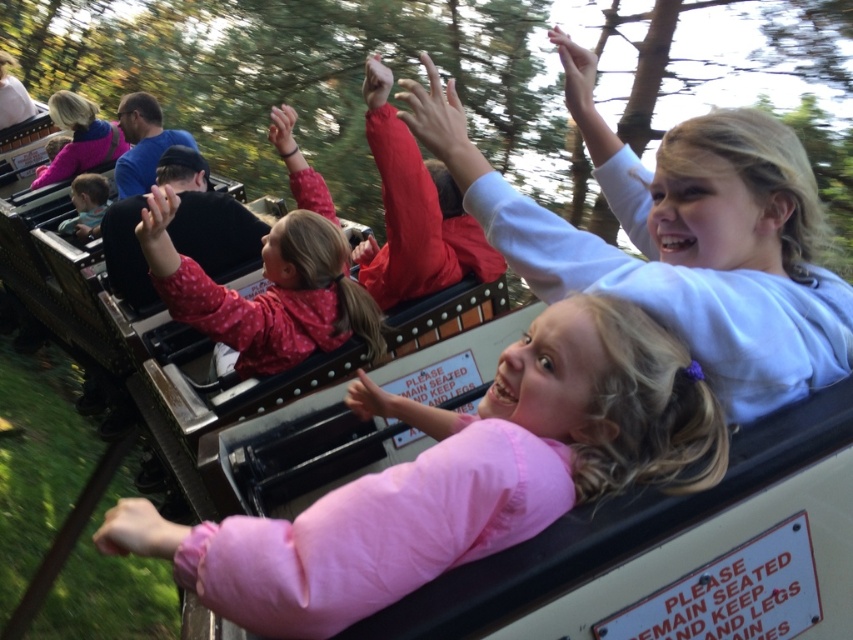
Question: Is white matte shirt at upper right to the right of matte pink jacket at upper left from the viewer's perspective?

Choices:
 (A) yes
 (B) no

Answer: (A)

Question: Which of the following is the closest to the observer?

Choices:
 (A) pink fabric at center
 (B) pink dotted jacket at center
 (C) matte pink jacket at upper left
 (D) white matte shirt at upper right

Answer: (A)

Question: Can you confirm if pink dotted jacket at center is positioned to the left of matte pink jacket at upper left?

Choices:
 (A) no
 (B) yes

Answer: (A)

Question: Is pink fabric at center further to the viewer compared to matte pink jacket at upper left?

Choices:
 (A) yes
 (B) no

Answer: (B)

Question: Among these points, which one is farthest from the camera?

Choices:
 (A) (370, 598)
 (B) (199, 316)

Answer: (B)

Question: Which of the following is the closest to the observer?

Choices:
 (A) (93, 115)
 (B) (279, 307)
 (C) (213, 547)
 (D) (730, 150)

Answer: (C)